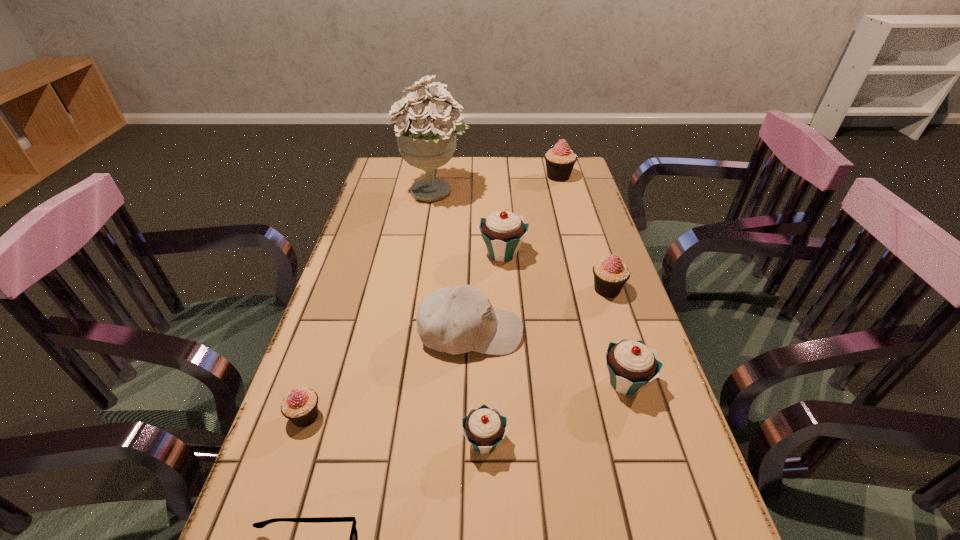
Find the location of a particular element. The width and height of the screenshot is (960, 540). bouquet is located at coordinates (426, 139).

The height and width of the screenshot is (540, 960). In order to click on green bouquet in this screenshot , I will do `click(426, 139)`.

Image resolution: width=960 pixels, height=540 pixels. In order to click on the farthest pink cupcake in this screenshot , I will do `click(560, 160)`.

This screenshot has height=540, width=960. Identify the location of the biggest pink cupcake. (560, 160).

Locate an element on the screen. the third farthest object is located at coordinates (502, 231).

At what (x,y) coordinates should I click in order to perform the action: click on the farthest teal cupcake. Please return your answer as a coordinate pair (x, y). Looking at the image, I should click on (502, 231).

Identify the location of the fifth farthest object. (457, 319).

The image size is (960, 540). In order to click on gray baseball cap in this screenshot , I will do `click(457, 319)`.

Identify the location of the third farthest cupcake. This screenshot has width=960, height=540. (610, 274).

Where is `the sixth nearest object`? the sixth nearest object is located at coordinates (610, 274).